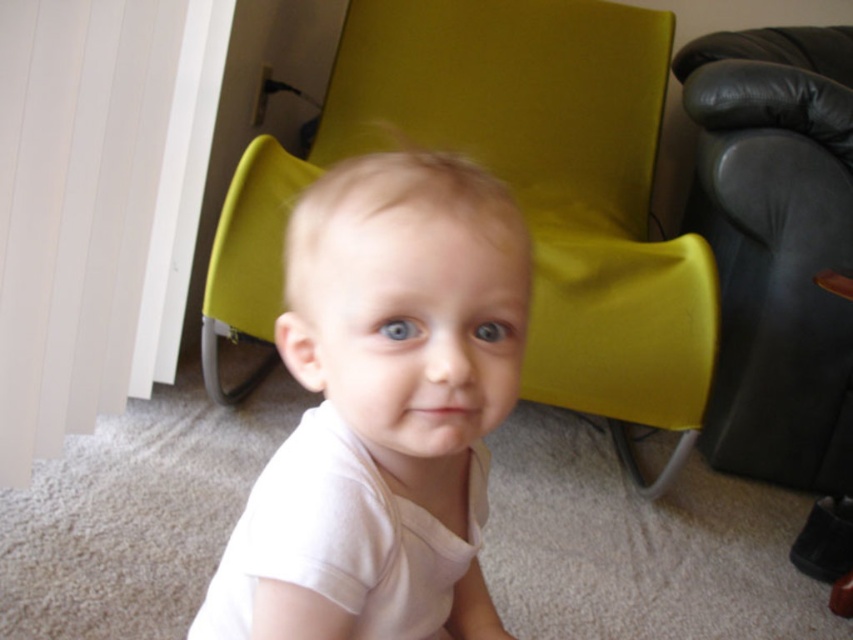
Question: Considering the real-world distances, which object is farthest from the white cotton shirt at center?

Choices:
 (A) black leather couch at right
 (B) matte green armchair at center

Answer: (A)

Question: Which point is farther to the camera?

Choices:
 (A) matte green armchair at center
 (B) black leather couch at right
 (C) white cotton shirt at center

Answer: (B)

Question: Among these points, which one is farthest from the camera?

Choices:
 (A) (463, 148)
 (B) (338, 426)
 (C) (770, 61)

Answer: (A)

Question: In this image, where is white cotton shirt at center located relative to matte green armchair at center?

Choices:
 (A) left
 (B) right

Answer: (A)

Question: Does white cotton shirt at center appear on the left side of matte green armchair at center?

Choices:
 (A) yes
 (B) no

Answer: (A)

Question: Considering the relative positions of white cotton shirt at center and black leather couch at right in the image provided, where is white cotton shirt at center located with respect to black leather couch at right?

Choices:
 (A) above
 (B) below

Answer: (B)